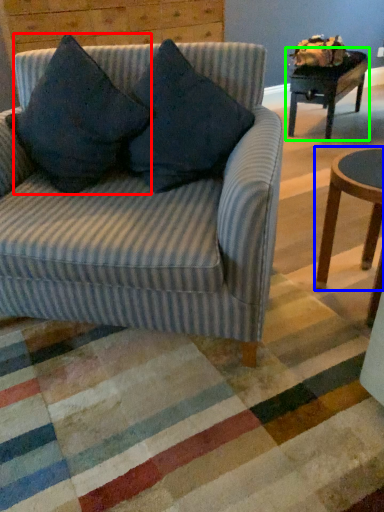
Question: Based on their relative distances, which object is nearer to throw pillow (highlighted by a red box)? Choose from coffee table (highlighted by a blue box) and table (highlighted by a green box).

Choices:
 (A) coffee table
 (B) table

Answer: (A)